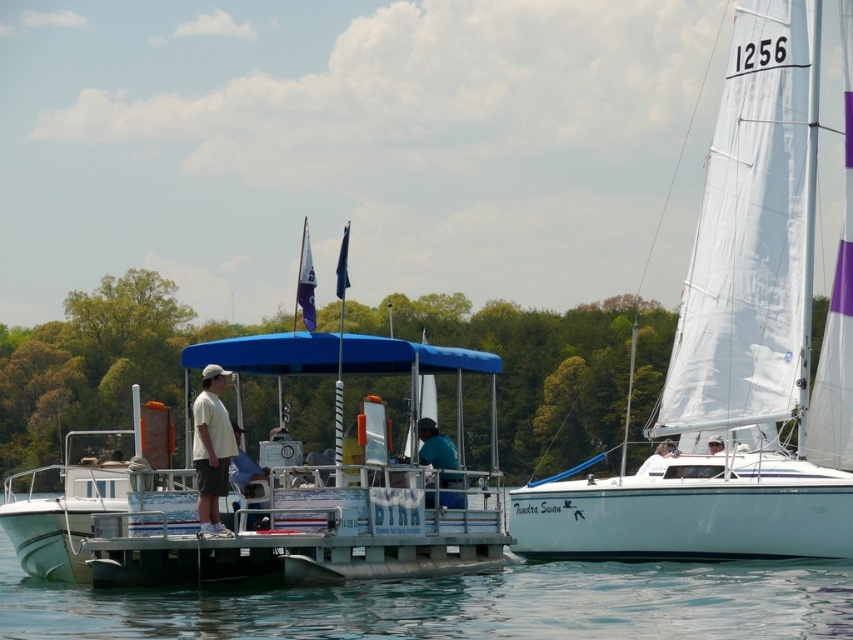
In the scene shown: You are a sailor who wants to ensure your boat can pass under a low bridge ahead. The bridge has a clearance height of 1.5 meters. Based on the scene, will the white sail at right and transparent water at center allow your boat to pass safely?

The white sail at right has a greater height compared to transparent water at center. Since the sail is taller than the water, and the bridge clearance is 1.5 meters, you need to determine if the sail is below that height. However, the description only states the sail is taller than the water but doesn

What is the location of the transparent water at center in the image?

The transparent water at center is located at point (461,604).

You are standing on the dock and see the white sail at right and the transparent water at center. Which object is located to the right of the other?

The white sail at right is positioned on the right side of transparent water at center, so the white sail at right is to the right of the transparent water at center.